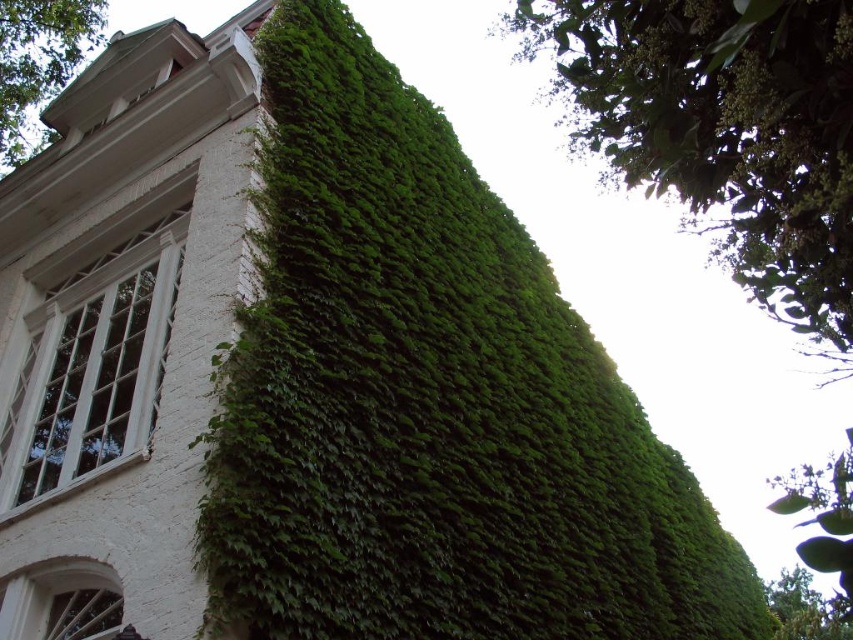
You are standing 100 meters away from a building with green leafy ivy at upper left. Can you see the ivy clearly from your current position?

The green leafy ivy at upper left is 99.12 meters away from the camera, so yes, you can see it clearly from 100 meters away since the distance is almost the same.